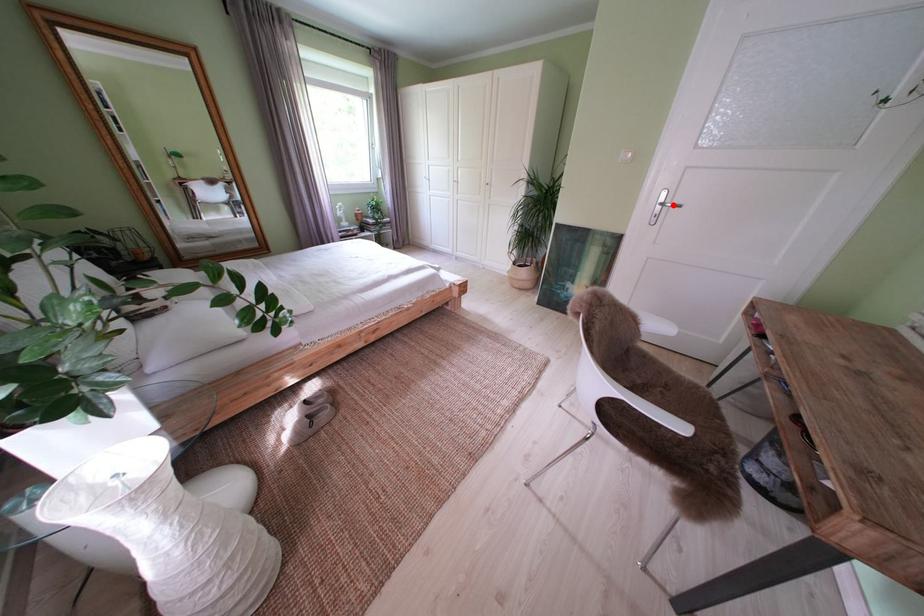
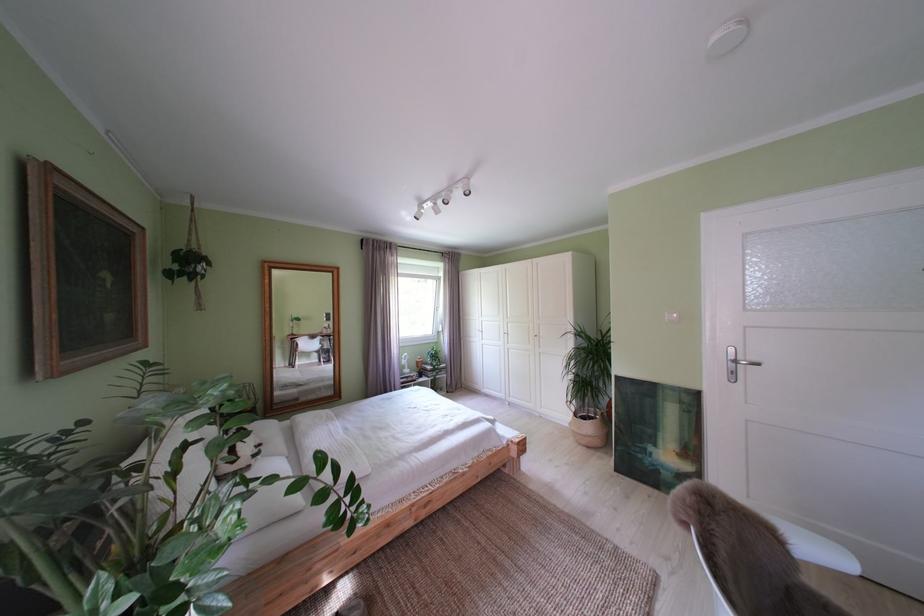
Question: I am providing you with two images of the same scene from different viewpoints. Given a red point in image1, look at the same physical point in image2. Is it:

Choices:
 (A) Closer to the viewpoint
 (B) Farther from the viewpoint

Answer: (B)